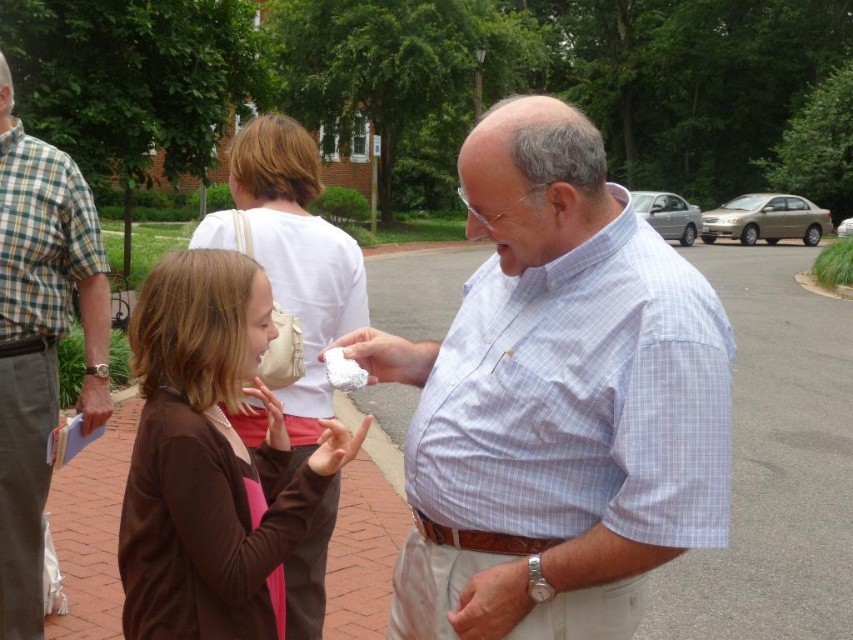
Question: Which object is positioned closest to the brown matte sweater at center?

Choices:
 (A) white fluffy cloud at center
 (B) checkered fabric shirt at left
 (C) light blue checkered shirt at center

Answer: (A)

Question: Is brown matte sweater at center to the right of white fluffy cloud at center from the viewer's perspective?

Choices:
 (A) no
 (B) yes

Answer: (A)

Question: Is brown matte sweater at center in front of white fluffy cloud at center?

Choices:
 (A) yes
 (B) no

Answer: (A)

Question: Among these points, which one is nearest to the camera?

Choices:
 (A) (625, 502)
 (B) (279, 461)
 (C) (335, 360)
 (D) (15, 429)

Answer: (A)

Question: Does checkered fabric shirt at left have a lesser width compared to white fluffy cloud at center?

Choices:
 (A) no
 (B) yes

Answer: (A)

Question: Which of the following is the farthest from the observer?

Choices:
 (A) (3, 314)
 (B) (355, 362)
 (C) (531, 294)

Answer: (A)